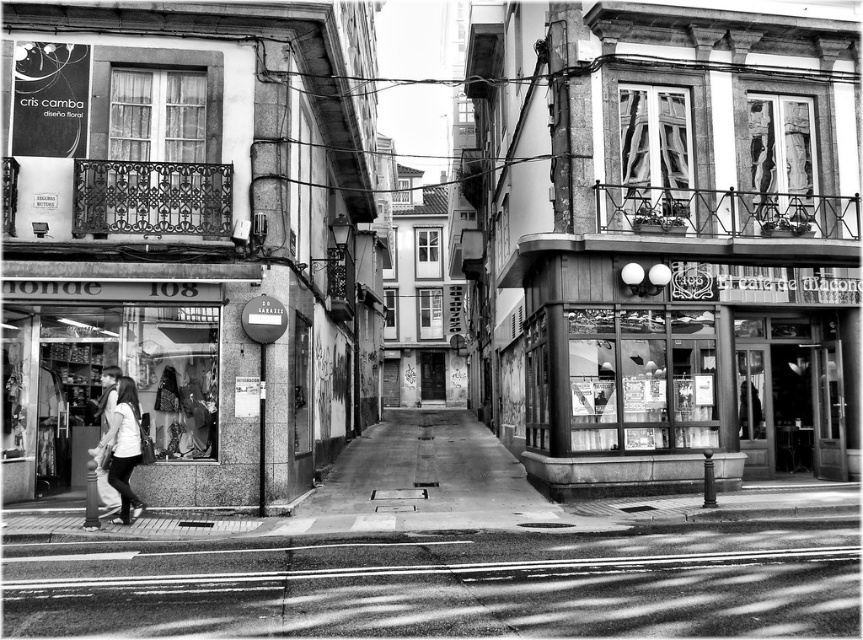
You are a delivery person standing on the smooth concrete pavement at lower center and need to deliver a package to the smooth white shirt at lower left. What obstacle might you encounter due to their relative positions?

The smooth concrete pavement at lower center is not as tall as the smooth white shirt at lower left, so the delivery person might have difficulty seeing or reaching the smooth white shirt at lower left because it is taller than the pavement.

You are standing at the point labeled as point [446,582] in the image. What type of surface are you standing on?

The point [446,582] corresponds to smooth concrete pavement at lower center, so you are standing on smooth concrete pavement.